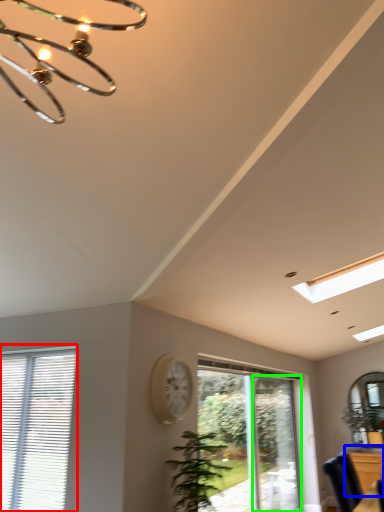
Question: Estimate the real-world distances between objects in this image. Which object is farther from window (highlighted by a red box), dresser (highlighted by a blue box) or screen door (highlighted by a green box)?

Choices:
 (A) dresser
 (B) screen door

Answer: (A)